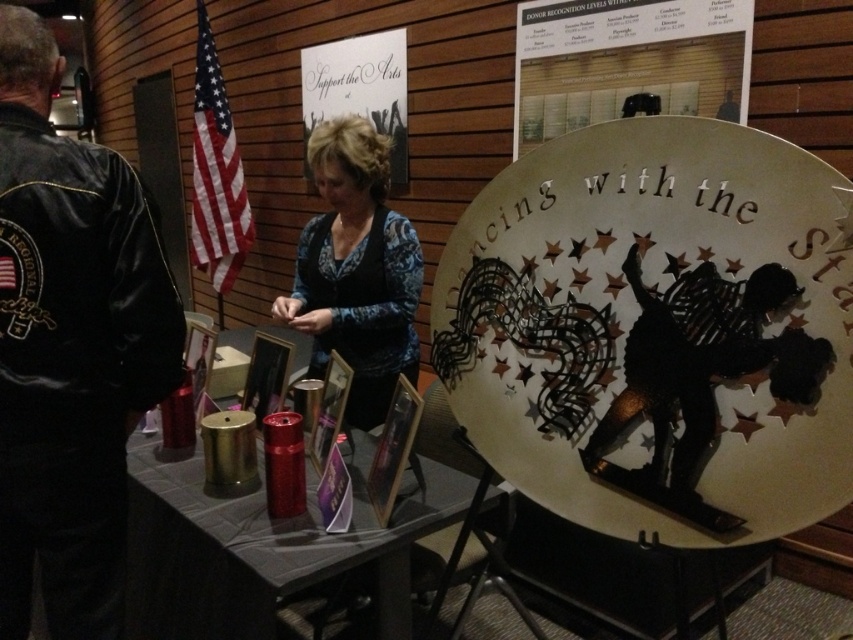
Between black leather jacket at left and blue patterned sweater at center, which one has less height?

blue patterned sweater at center is shorter.

The height and width of the screenshot is (640, 853). In order to click on black leather jacket at left in this screenshot , I will do `click(70, 348)`.

Who is higher up, metallic red thermos at lower center or blue patterned sweater at center?

blue patterned sweater at center

Between metallic red thermos at lower center and blue patterned sweater at center, which one is positioned lower?

metallic red thermos at lower center is below.

Image resolution: width=853 pixels, height=640 pixels. What are the coordinates of `metallic red thermos at lower center` in the screenshot? It's located at (262, 548).

Can you confirm if black leather jacket at left is positioned to the left of metallic red thermos at lower center?

Yes, black leather jacket at left is to the left of metallic red thermos at lower center.

Is black leather jacket at left wider than metallic red thermos at lower center?

No.

Is point (0, 337) in front of point (328, 540)?

Yes, it is in front of point (328, 540).

Where is `black leather jacket at left`? This screenshot has height=640, width=853. black leather jacket at left is located at coordinates (70, 348).